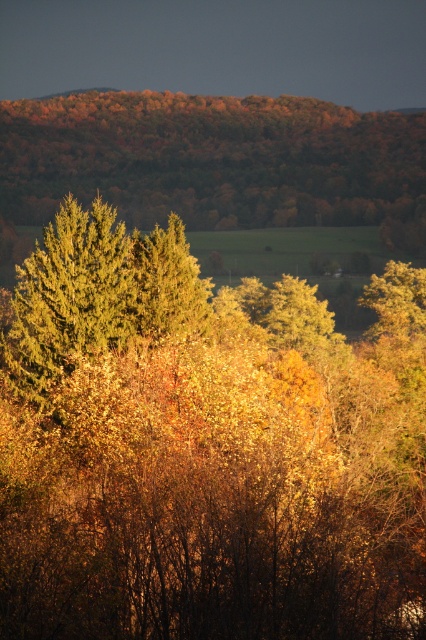
You are standing in the autumn landscape and want to take a photo of both the green matte tree at upper center and the green matte tree at center. Which tree should you focus on first if you want to include both in your frame without moving the camera?

You should focus on the green matte tree at upper center first because it is larger in size compared to the green matte tree at center, allowing it to be more prominently featured while still fitting both into the frame.

You are standing at the base of the green matte tree at upper center, and you want to take a photo of the autumn landscape. Since the tree is 621.33 feet away from the camera, will you be able to see the entire tree in your photo without moving closer?

The green matte tree at upper center is 621.33 feet away from the camera. Since you are standing at its base, you are not at the camera position. To capture the entire tree in the photo from the camera location, the distance might make it appear small, but the exact visibility depends on the camera lens and field of view. However, the question only asks if you can see the entire tree without moving closer from the camera position. The distance itself doesn not prevent seeing the tree, but the field of view.